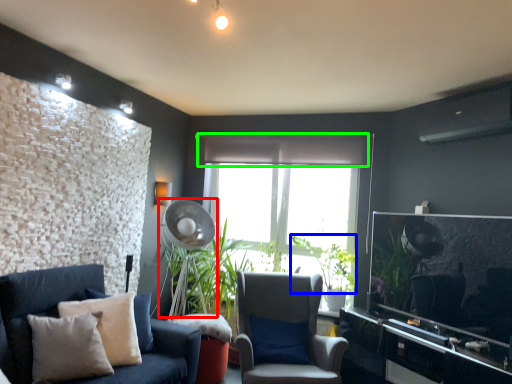
Question: Which object is positioned farthest from mechanical fan (highlighted by a red box)? Select from plant (highlighted by a blue box) and curtain (highlighted by a green box).

Choices:
 (A) plant
 (B) curtain

Answer: (A)